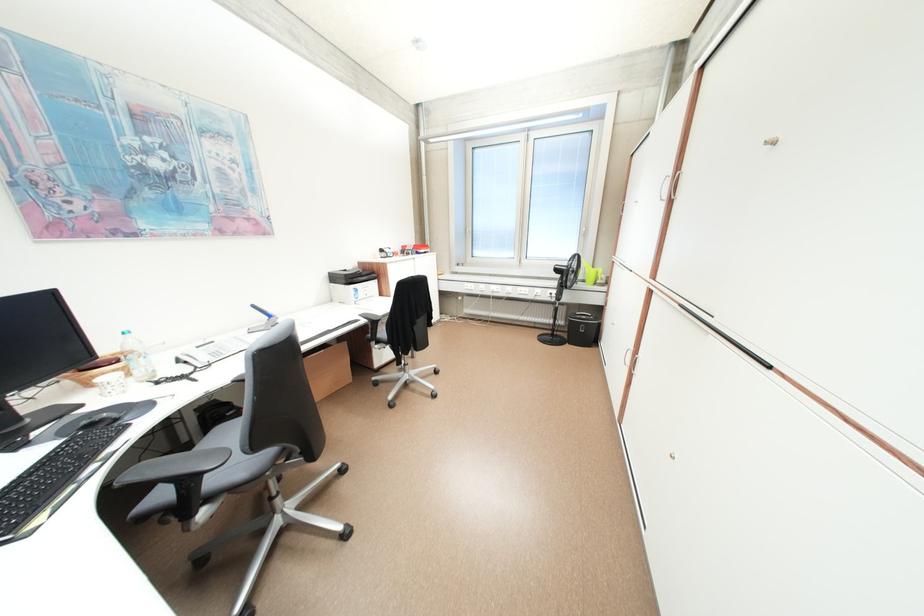
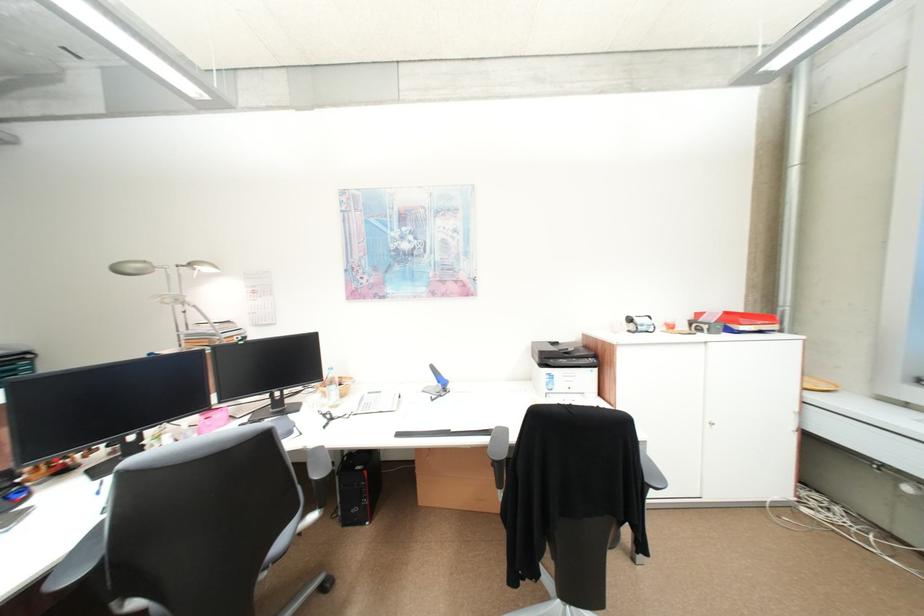
Where in the second image is the point corresponding to pixel 356 276 from the first image?

(551, 353)